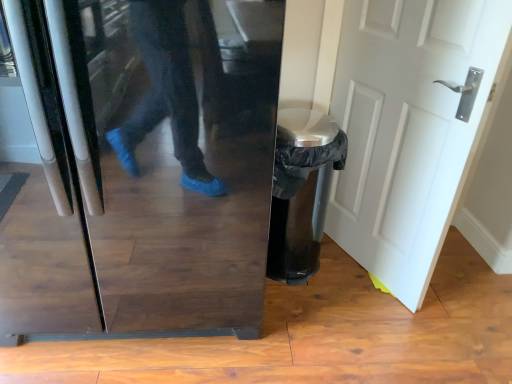
Question: From a real-world perspective, is white matte door at center physically below glossy black refrigerator at center?

Choices:
 (A) no
 (B) yes

Answer: (B)

Question: Is white matte door at center touching glossy black refrigerator at center?

Choices:
 (A) yes
 (B) no

Answer: (B)

Question: Is white matte door at center oriented away from glossy black refrigerator at center?

Choices:
 (A) yes
 (B) no

Answer: (A)

Question: Considering the relative positions of white matte door at center and glossy black refrigerator at center in the image provided, is white matte door at center to the left of glossy black refrigerator at center from the viewer's perspective?

Choices:
 (A) yes
 (B) no

Answer: (B)

Question: Considering the relative sizes of white matte door at center and glossy black refrigerator at center in the image provided, is white matte door at center thinner than glossy black refrigerator at center?

Choices:
 (A) no
 (B) yes

Answer: (B)

Question: Considering the relative sizes of white matte door at center and glossy black refrigerator at center in the image provided, is white matte door at center taller than glossy black refrigerator at center?

Choices:
 (A) yes
 (B) no

Answer: (A)

Question: Does glossy black refrigerator at center appear on the left side of white matte door at center?

Choices:
 (A) no
 (B) yes

Answer: (B)

Question: Considering the relative sizes of glossy black refrigerator at center and white matte door at center in the image provided, is glossy black refrigerator at center wider than white matte door at center?

Choices:
 (A) no
 (B) yes

Answer: (B)

Question: Does glossy black refrigerator at center lie in front of white matte door at center?

Choices:
 (A) yes
 (B) no

Answer: (A)

Question: From a real-world perspective, is glossy black refrigerator at center positioned over white matte door at center based on gravity?

Choices:
 (A) no
 (B) yes

Answer: (B)

Question: Is glossy black refrigerator at center looking in the opposite direction of white matte door at center?

Choices:
 (A) no
 (B) yes

Answer: (A)

Question: Is glossy black refrigerator at center bigger than white matte door at center?

Choices:
 (A) no
 (B) yes

Answer: (B)

Question: Would you say white matte door at center is to the left or to the right of glossy black refrigerator at center in the picture?

Choices:
 (A) right
 (B) left

Answer: (A)